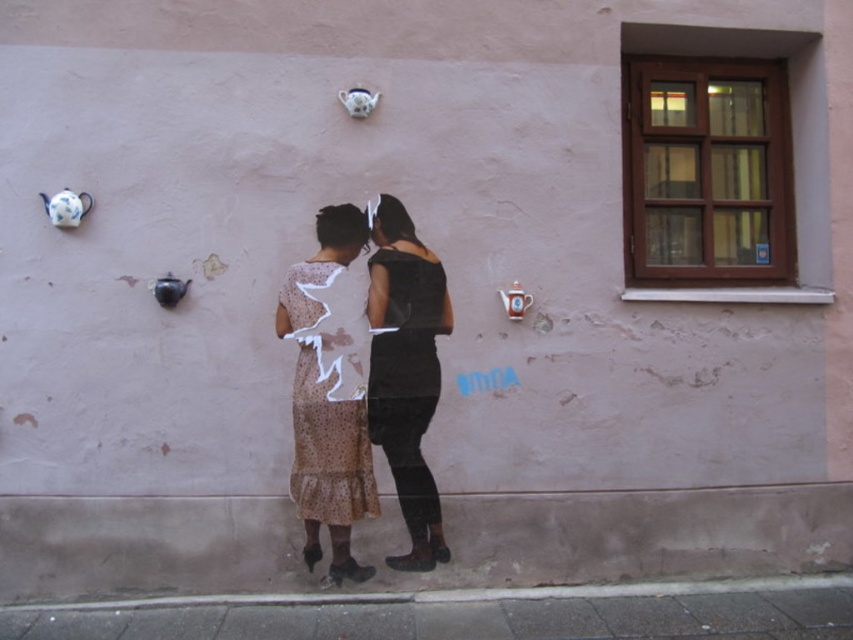
Identify the location of black matte dress at center. The width and height of the screenshot is (853, 640). (405, 371).

Between point (372, 305) and point (347, 396), which one is positioned behind?

The point (372, 305) is more distant.

Where is `black matte dress at center`? The height and width of the screenshot is (640, 853). black matte dress at center is located at coordinates (405, 371).

You are a GUI agent. You are given a task and a screenshot of the screen. Output one action in this format:
    pyautogui.click(x=<x>, y=<y>)
    Task: Click on the black matte dress at center
    This screenshot has width=853, height=640.
    Given the screenshot: What is the action you would take?
    pyautogui.click(x=405, y=371)

Is point (338, 250) more distant than point (312, 304)?

Yes, point (338, 250) is behind point (312, 304).

The image size is (853, 640). Find the location of `matte white dress at center`. matte white dress at center is located at coordinates (405, 369).

Is the position of matte white dress at center less distant than that of black matte dress at center?

Yes, it is in front of black matte dress at center.

Does matte white dress at center appear on the right side of black matte dress at center?

In fact, matte white dress at center is to the left of black matte dress at center.

You are a GUI agent. You are given a task and a screenshot of the screen. Output one action in this format:
    pyautogui.click(x=<x>, y=<y>)
    Task: Click on the matte white dress at center
    
    Given the screenshot: What is the action you would take?
    coord(405,369)